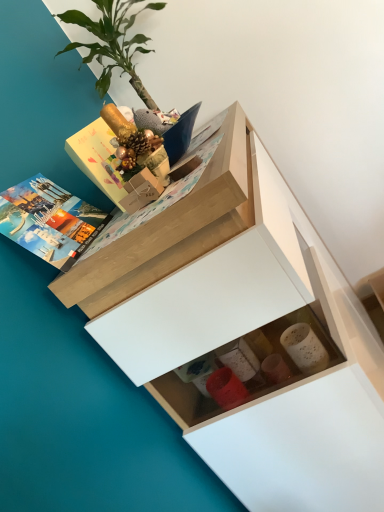
Question: Is point tap(236, 223) positioned closer to the camera than point tap(54, 200)?

Choices:
 (A) closer
 (B) farther

Answer: (A)

Question: Considering the relative positions of white matte chest of drawers at upper center and matte hardcover book at upper left in the image provided, is white matte chest of drawers at upper center to the left or to the right of matte hardcover book at upper left?

Choices:
 (A) left
 (B) right

Answer: (B)

Question: Considering the real-world distances, which object is closest to the white matte chest of drawers at upper center?

Choices:
 (A) matte hardcover book at upper left
 (B) green leafy plant at upper left

Answer: (A)

Question: Estimate the real-world distances between objects in this image. Which object is closer to the white matte chest of drawers at upper center?

Choices:
 (A) matte hardcover book at upper left
 (B) green leafy plant at upper left

Answer: (A)